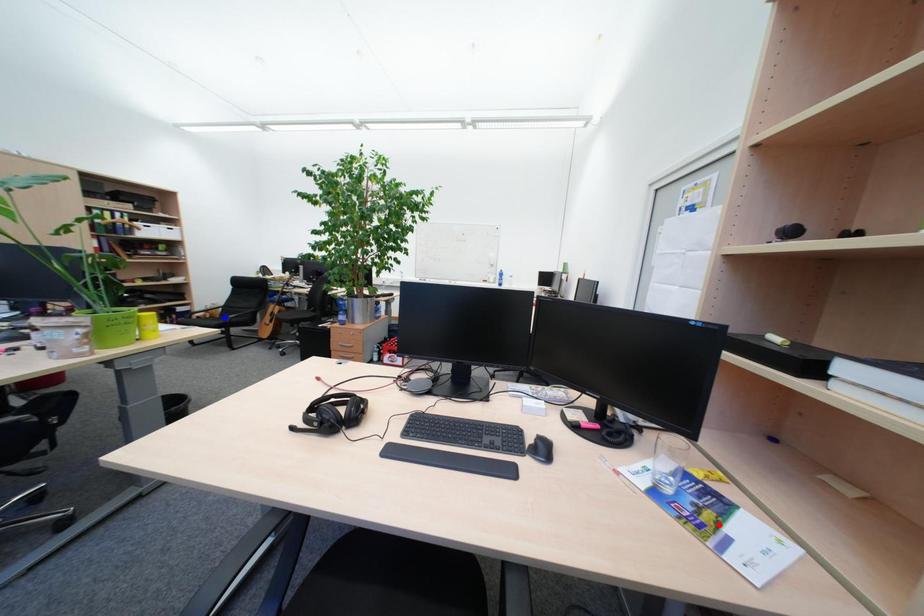
Question: Two points are marked on the image. Which point is closer to the camera?

Choices:
 (A) Blue point is closer.
 (B) Red point is closer.

Answer: (B)